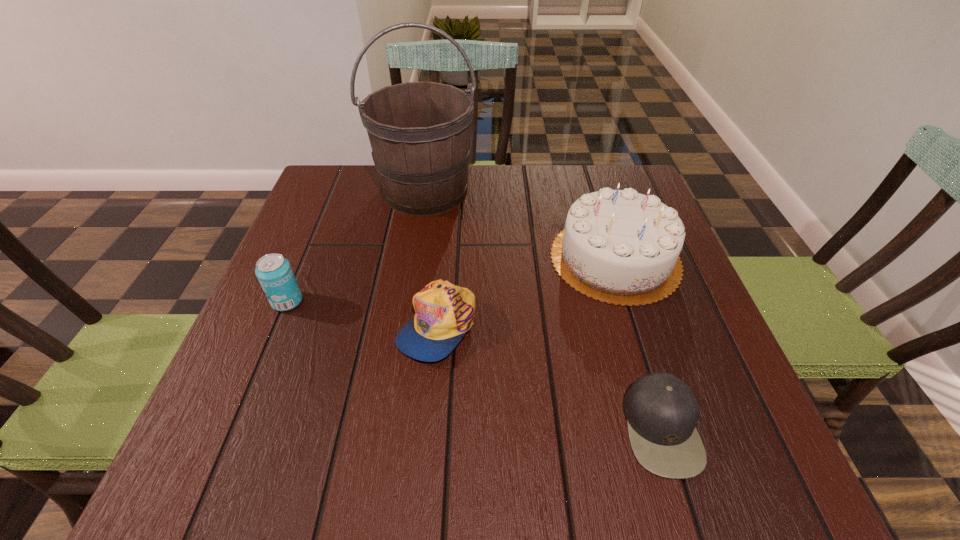
Locate which object is the second closest to the third shortest object. Please provide its 2D coordinates. Your answer should be formatted as a tuple, i.e. [(x, y)], where the tuple contains the x and y coordinates of a point satisfying the conditions above.

[(419, 132)]

The image size is (960, 540). I want to click on blank space that satisfies the following two spatial constraints: 1. on the back side of the third shortest object; 2. on the left side of the birthday cake, so click(x=305, y=258).